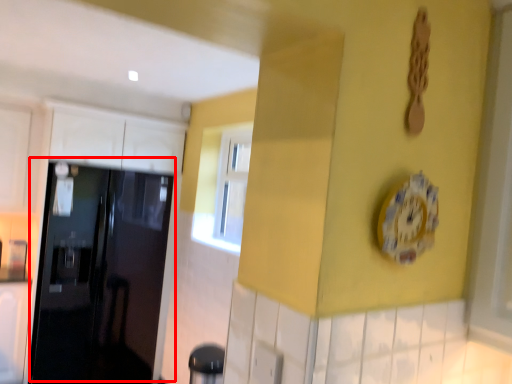
Question: From the image's perspective, what is the correct spatial positioning of door (annotated by the red box) in reference to clock?

Choices:
 (A) below
 (B) above

Answer: (A)